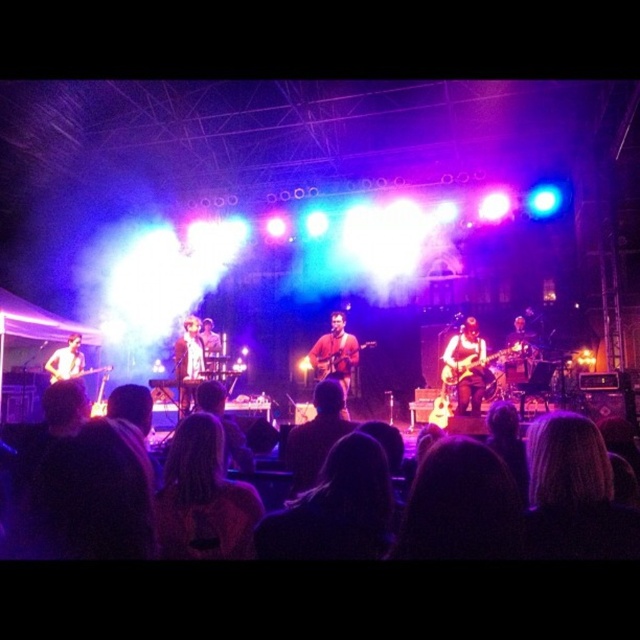
Between point (481, 372) and point (67, 353), which one is positioned behind?

The point (67, 353) is more distant.

Can you confirm if glossy electric guitar at center is positioned to the right of matte black guitar at left?

Correct, you'll find glossy electric guitar at center to the right of matte black guitar at left.

Measure the distance between glossy electric guitar at center and camera.

glossy electric guitar at center is 24.97 feet from camera.

Where is `glossy electric guitar at center`? The width and height of the screenshot is (640, 640). glossy electric guitar at center is located at coordinates (481, 364).

Is matte black guitar at center above brushed metal guitar at left?

Yes.

Who is positioned more to the left, matte black guitar at center or brushed metal guitar at left?

brushed metal guitar at left is more to the left.

Which is behind, point (193, 348) or point (80, 376)?

Positioned behind is point (80, 376).

Where is `matte black guitar at center`? matte black guitar at center is located at coordinates (188, 362).

Is black hair at lower center below glossy electric guitar at center?

Incorrect, black hair at lower center is not positioned below glossy electric guitar at center.

Based on the photo, who is lower down, black hair at lower center or glossy electric guitar at center?

glossy electric guitar at center is below.

Is point (349, 461) farther from camera compared to point (445, 364)?

That is False.

What are the coordinates of `black hair at lower center` in the screenshot? It's located at (518, 500).